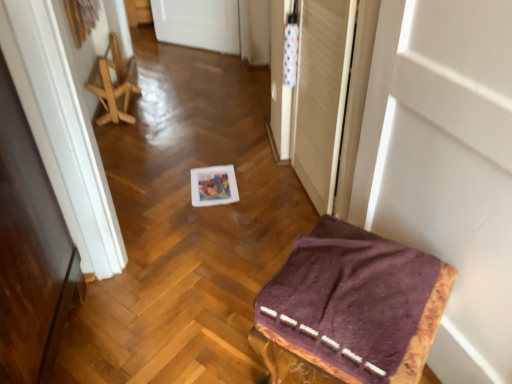
The height and width of the screenshot is (384, 512). I want to click on vacant area that lies between transparent plastic screen door at upper right and wooden folding chair at left, which is the first furniture from back to front, so click(x=200, y=146).